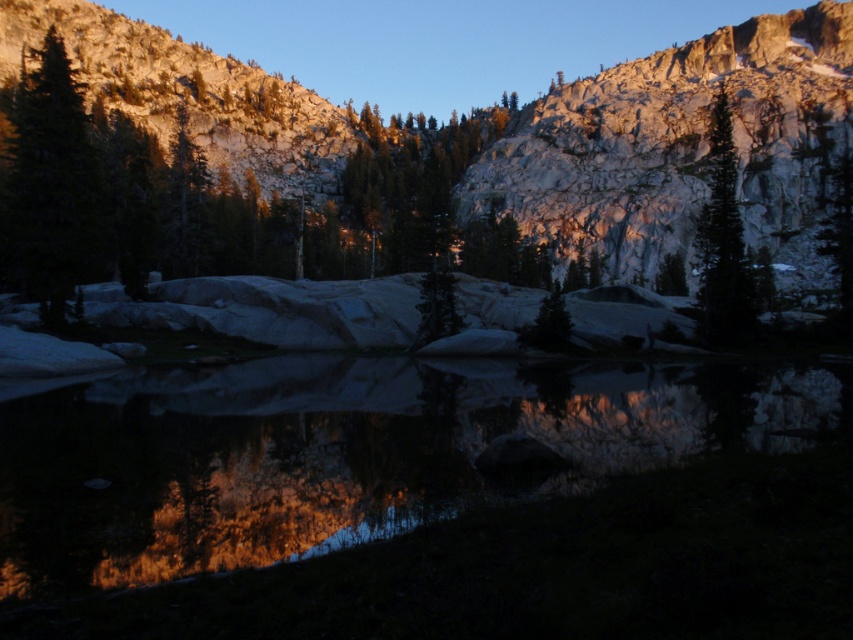
Question: Can you confirm if transparent water at center is positioned to the right of green matte tree at upper right?

Choices:
 (A) no
 (B) yes

Answer: (A)

Question: Which object is farther from the camera taking this photo?

Choices:
 (A) transparent water at center
 (B) green matte tree at upper right
 (C) green matte tree at left

Answer: (B)

Question: Is transparent water at center to the right of green matte tree at upper right from the viewer's perspective?

Choices:
 (A) yes
 (B) no

Answer: (B)

Question: Which object is farther from the camera taking this photo?

Choices:
 (A) transparent water at center
 (B) green matte tree at left
 (C) green matte tree at upper right

Answer: (C)

Question: Is transparent water at center smaller than green matte tree at left?

Choices:
 (A) no
 (B) yes

Answer: (B)

Question: Which point is closer to the camera?

Choices:
 (A) (740, 220)
 (B) (202, 518)
 (C) (93, 205)

Answer: (B)